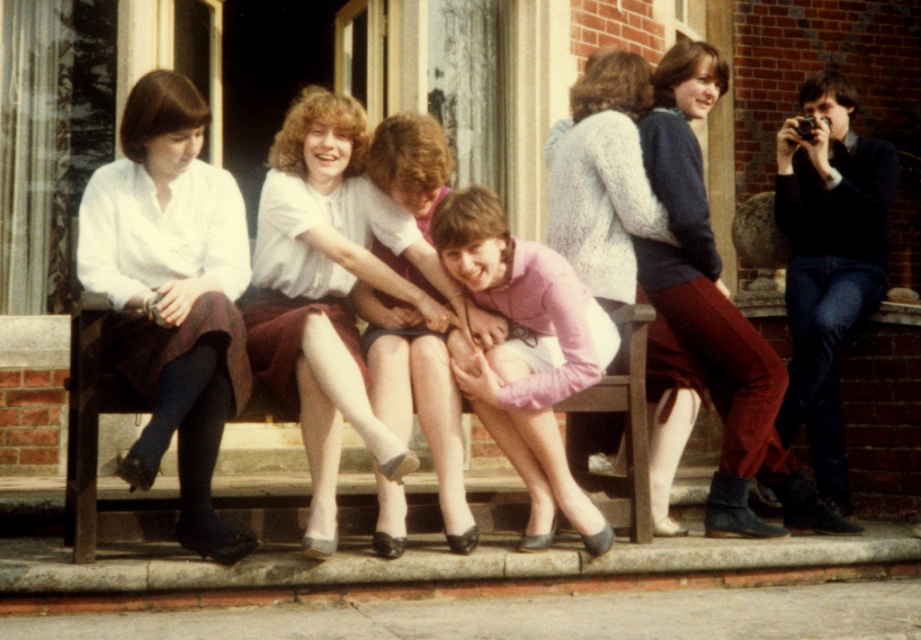
Is matte white blouse at left above pink matte sweater at center?

Yes.

The image size is (921, 640). Find the location of `matte white blouse at left`. matte white blouse at left is located at coordinates (172, 294).

Can you confirm if matte white blouse at left is positioned to the left of matte white blouse at center?

In fact, matte white blouse at left is to the right of matte white blouse at center.

Is matte white blouse at left further to the viewer compared to matte white blouse at center?

No.

Where is `matte white blouse at left`? The width and height of the screenshot is (921, 640). matte white blouse at left is located at coordinates (172, 294).

Between white sheer tights at center and pink matte sweater at center, which one is positioned higher?

white sheer tights at center

Find the location of a particular element. This screenshot has width=921, height=640. white sheer tights at center is located at coordinates pyautogui.click(x=329, y=291).

Who is more distant from viewer, (289, 180) or (504, 308)?

The point (504, 308) is more distant.

Locate an element on the screen. white sheer tights at center is located at coordinates (329, 291).